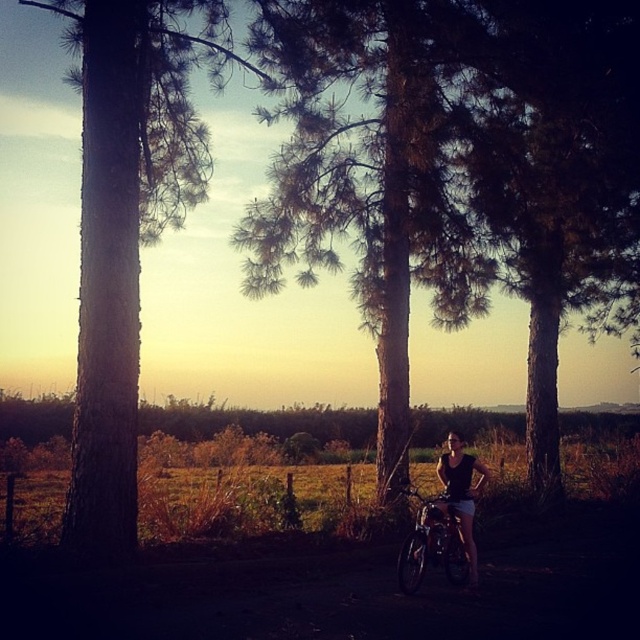
You are a GUI agent. You are given a task and a screenshot of the screen. Output one action in this format:
    pyautogui.click(x=<x>, y=<y>)
    Task: Click on the green textured tree at center
    The height and width of the screenshot is (640, 640).
    Given the screenshot: What is the action you would take?
    pyautogui.click(x=364, y=182)

Locate an element on the screen. green textured tree at center is located at coordinates (364, 182).

You are a GUI agent. You are given a task and a screenshot of the screen. Output one action in this format:
    pyautogui.click(x=<x>, y=<y>)
    Task: Click on the green textured tree at center
    
    Given the screenshot: What is the action you would take?
    pyautogui.click(x=364, y=182)

Can you confirm if brown rough bark tree at left is positioned to the left of shiny metallic bicycle at center?

Yes, brown rough bark tree at left is to the left of shiny metallic bicycle at center.

Is point (104, 394) behind point (449, 516)?

No.

At what (x,y) coordinates should I click in order to perform the action: click on brown rough bark tree at left. Please return your answer as a coordinate pair (x, y). Looking at the image, I should click on (129, 221).

Find the location of a particular element. The image size is (640, 640). brown rough bark tree at left is located at coordinates (129, 221).

Can you confirm if brown rough bark tree at left is shorter than black fabric tank top at center?

No, brown rough bark tree at left is not shorter than black fabric tank top at center.

Is point (188, 106) closer to camera compared to point (465, 492)?

No, it is not.

Find the location of a particular element. The width and height of the screenshot is (640, 640). brown rough bark tree at left is located at coordinates (129, 221).